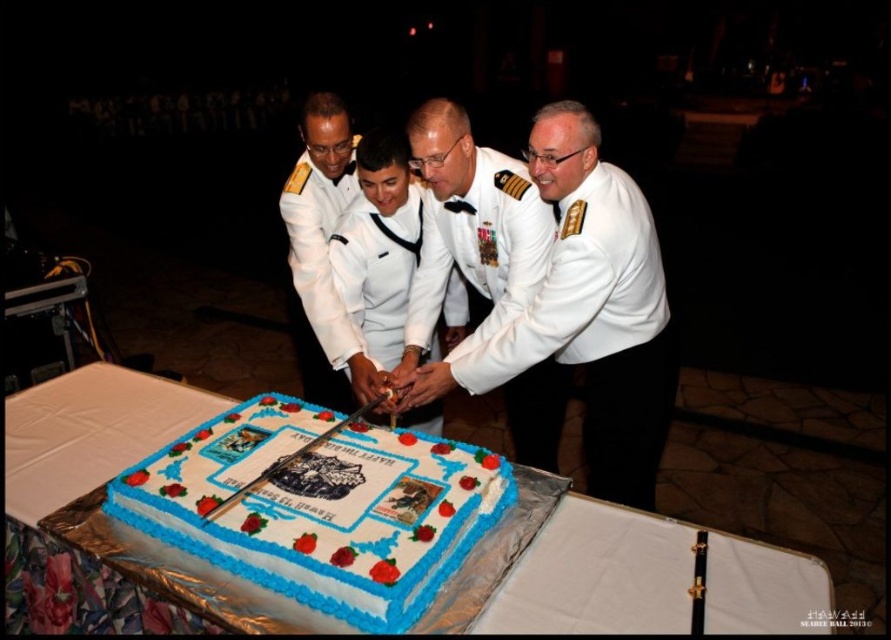
You are a photographer at the event and want to capture a photo where the white fondant cake at center and the white uniform at center are both visible. Based on their positions, which object should be placed on the left side of the photo frame?

The white fondant cake at center is to the left of the white uniform at center, so the cake should be placed on the left side of the photo frame to ensure both are visible.

You are a photographer at the event and want to capture a photo where the white glossy cake at center is clearly visible without being blocked by the white smooth uniform at center. Based on their positions, is this possible?

The white glossy cake at center is located above the white smooth uniform at center, so it is possible to capture the cake without obstruction by adjusting the camera angle slightly downward to avoid the uniform.

You are a photographer positioned at the back of the room. You want to take a photo of the white fondant cake at center and the white uniform at center so that both are clearly visible. Given that your camera has a depth of field that can sharply focus on objects within a 25 inch range, will both subjects be in focus?

The white fondant cake at center is 26.44 inches away from the white uniform at center. Since the distance between them exceeds the camera sensor depth of field range of 25 inches, only one of them can be in focus at a time. To capture both sharply, you might need to adjust your camera settings or use a different lens with a larger depth of field.